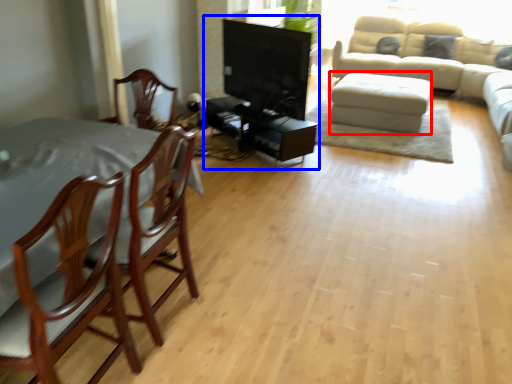
Question: Which point is closer to the camera, footrest (highlighted by a red box) or entertainment center (highlighted by a blue box)?

Choices:
 (A) footrest
 (B) entertainment center

Answer: (B)